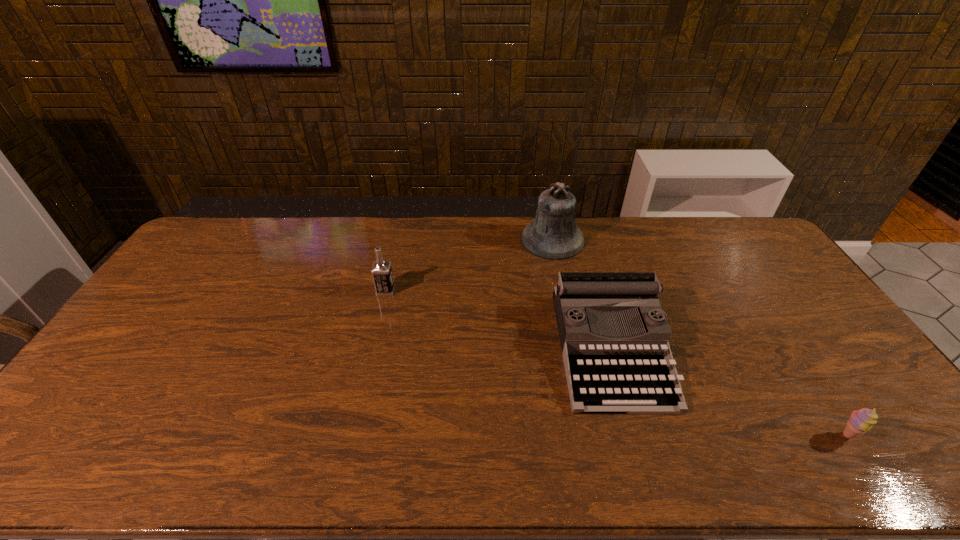
Where is `free space located 0.090m on the typing side of the typewriter`? The image size is (960, 540). free space located 0.090m on the typing side of the typewriter is located at coordinates (638, 448).

Locate an element on the screen. The height and width of the screenshot is (540, 960). free space located 0.200m on the left of the sherbert is located at coordinates (755, 435).

What are the coordinates of `object located in the far edge section of the desktop` in the screenshot? It's located at pos(553,234).

Locate an element on the screen. object that is at the near edge is located at coordinates (861, 420).

Locate an element on the screen. The image size is (960, 540). object that is at the right edge is located at coordinates (861, 420).

In order to click on object at the near right corner in this screenshot , I will do `click(861, 420)`.

You are a GUI agent. You are given a task and a screenshot of the screen. Output one action in this format:
    pyautogui.click(x=<x>, y=<y>)
    Task: Click on the vacant space at the far edge
    
    Given the screenshot: What is the action you would take?
    pyautogui.click(x=300, y=241)

Find the location of a particular element. The width and height of the screenshot is (960, 540). vacant region at the near edge of the desktop is located at coordinates (x=314, y=458).

Locate an element on the screen. The height and width of the screenshot is (540, 960). vacant space at the right edge of the desktop is located at coordinates point(796,289).

Find the location of `free spot between the tallest object and the leftmost object`. free spot between the tallest object and the leftmost object is located at coordinates (469, 265).